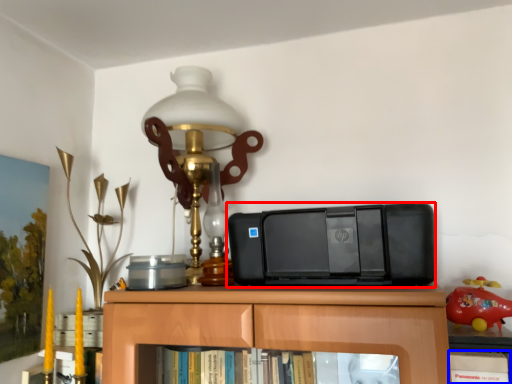
Question: Which point is closer to the camera, printer (highlighted by a red box) or book (highlighted by a blue box)?

Choices:
 (A) printer
 (B) book

Answer: (B)